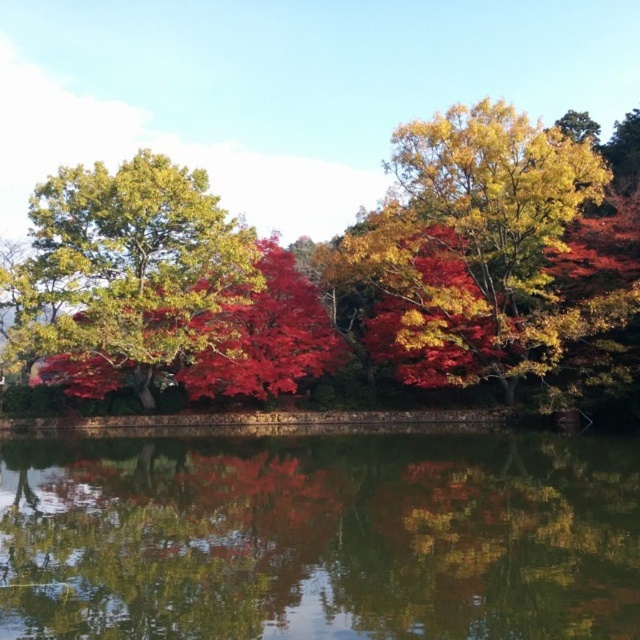
You are standing in the autumn landscape and want to take a photo of the green reflective water at center and the shiny green leaves at left. Which object is positioned closer to you?

The green reflective water at center is closer to the viewer than the shiny green leaves at left.

You are standing 10 meters away from the green reflective water at center. Can you safely walk towards it without getting wet?

The green reflective water at center is 12.12 meters away from the camera. Since you are standing 10 meters away from it, you are still 2.12 meters away from the water and can safely walk towards it without getting wet.

You are an artist planning to paint the autumn scene. You want to ensure the shiny red leaves at center and the shiny green leaves at left are proportionally accurate. Which of the two leaves should you make larger in your painting?

The shiny red leaves at center should be painted larger than the shiny green leaves at left because they are described as bigger in the scene.